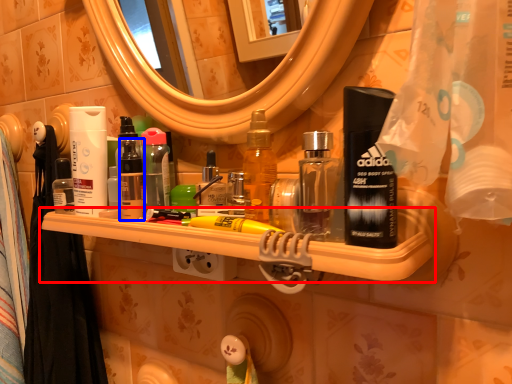
Question: Which object is further to the camera taking this photo, shelf (highlighted by a red box) or toiletry (highlighted by a blue box)?

Choices:
 (A) shelf
 (B) toiletry

Answer: (B)